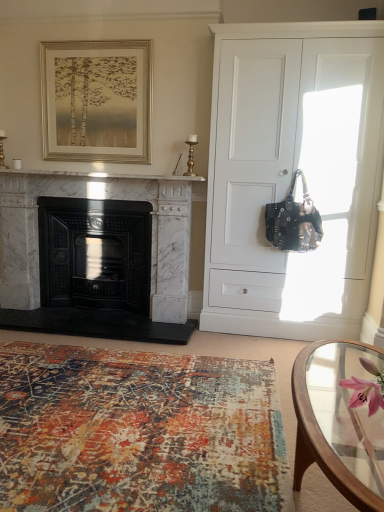
In order to click on vacant point above gold-toned wooden frame at upper center (from a real-world perspective) in this screenshot , I will do `click(92, 39)`.